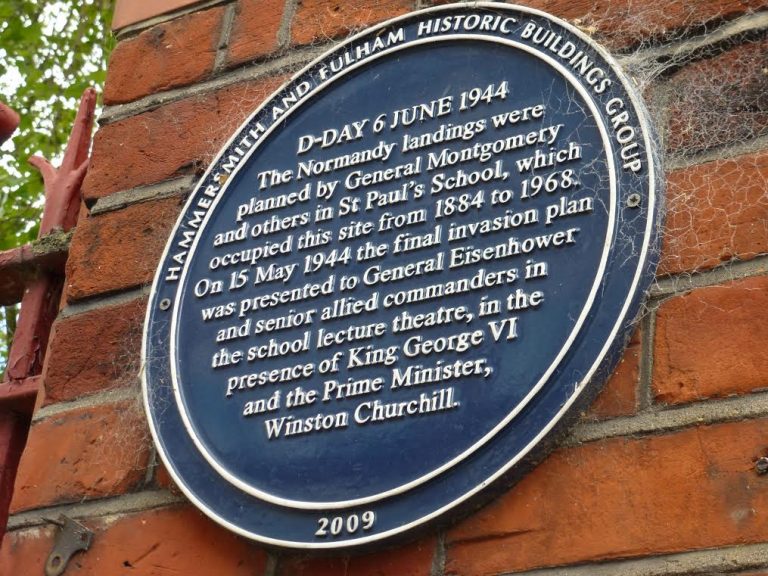
Identify the location of plaque. This screenshot has width=768, height=576. (406, 82).